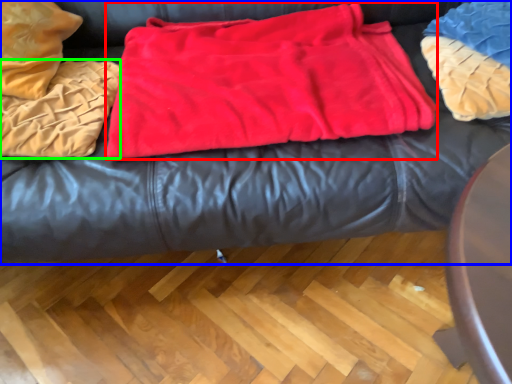
Question: Considering the real-world distances, which object is farthest from blanket (highlighted by a red box)? furniture (highlighted by a blue box) or blanket (highlighted by a green box)?

Choices:
 (A) furniture
 (B) blanket

Answer: (B)